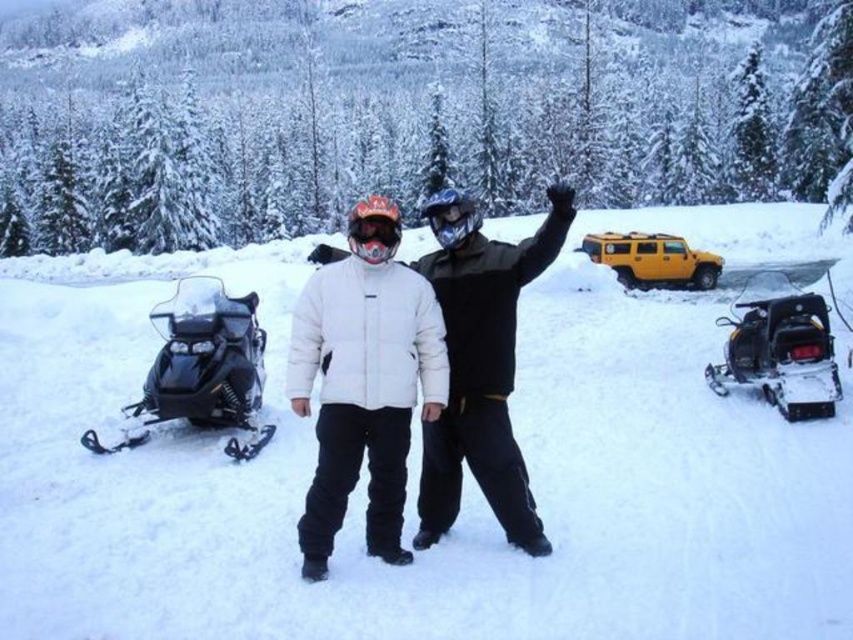
You are planning to take a photo of the white fluffy snow at center and the white matte jacket at center. Which object should you focus on first if you want to capture both in the same frame without moving the camera?

The white fluffy snow at center has a larger size compared to the white matte jacket at center, so you should focus on the white fluffy snow at center first to ensure it fills the frame appropriately before adjusting for the smaller jacket.